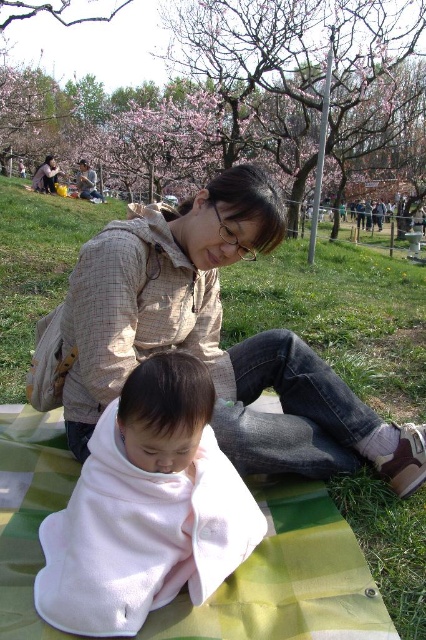
You are standing at the center of the park and see the light brown plaid jacket at center. Can you tell me what is located exactly at the point with coordinates [218,339]?

The light brown plaid jacket at center is located exactly at the point with coordinates [218,339].

Looking at this image, you are a photographer trying to capture the woman and baby in the scene. You need to ensure both the light brown plaid jacket at center and the white fleece blanket at center are clearly visible in the photo. Given their sizes, which object might require you to adjust your camera focus more carefully to ensure it doesn

The white fleece blanket at center might require more careful focus adjustment since it is smaller in size compared to the light brown plaid jacket at center, making it potentially harder to capture clearly in the same frame.

Please provide the 2D coordinates of the white fleece blanket at center in the image. The answer should be in the format of coordinates within parentheses, like this example format. Please do not add any extra text or explanation.

The 2D coordinates of the white fleece blanket at center are at point (146,508).